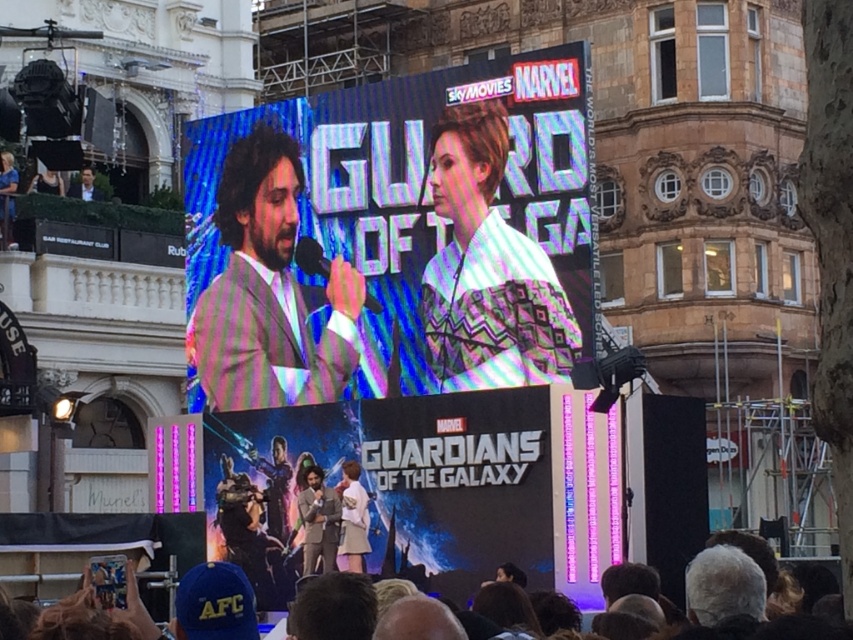
Who is higher up, matte black suit at center or white fabric skirt at center?

white fabric skirt at center

Between matte black suit at center and white fabric skirt at center, which one is positioned lower?

matte black suit at center is lower down.

This screenshot has height=640, width=853. I want to click on matte black suit at center, so click(318, 520).

You are a GUI agent. You are given a task and a screenshot of the screen. Output one action in this format:
    pyautogui.click(x=<x>, y=<y>)
    Task: Click on the matte black suit at center
    
    Given the screenshot: What is the action you would take?
    pyautogui.click(x=318, y=520)

Does matte digital screen at center come behind white fabric skirt at center?

No.

Does matte digital screen at center appear on the left side of white fabric skirt at center?

Incorrect, matte digital screen at center is not on the left side of white fabric skirt at center.

Between point (496, 358) and point (364, 504), which one is positioned behind?

Point (364, 504)

Find the location of `matte digital screen at center`. matte digital screen at center is located at coordinates (407, 240).

Measure the distance between matte digital screen at center and camera.

matte digital screen at center is 141.87 feet away from camera.

You are a GUI agent. You are given a task and a screenshot of the screen. Output one action in this format:
    pyautogui.click(x=<x>, y=<y>)
    Task: Click on the matte digital screen at center
    The image size is (853, 640).
    Given the screenshot: What is the action you would take?
    pyautogui.click(x=407, y=240)